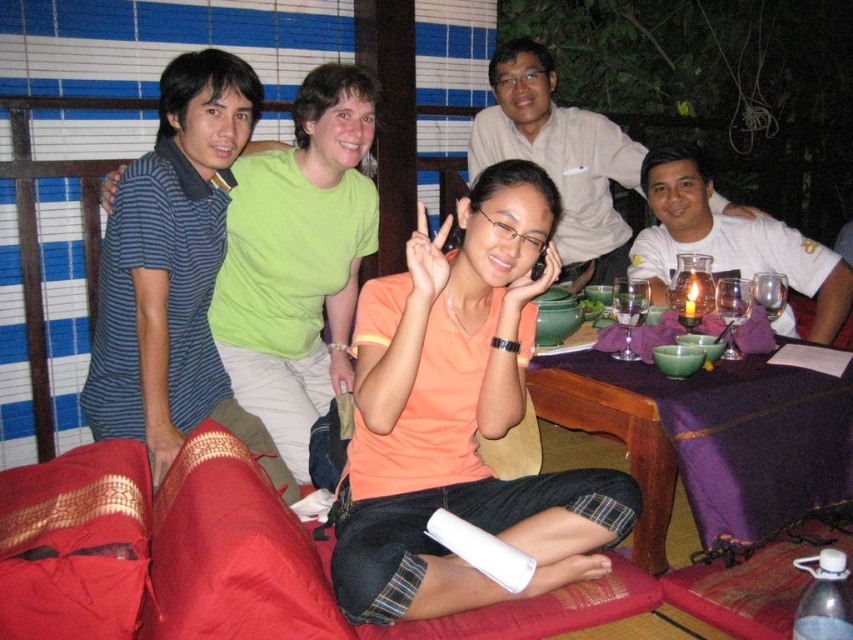
Between point (407, 401) and point (614, 401), which one is positioned behind?

Point (614, 401)

Is point (602, 531) less distant than point (654, 456)?

Yes.

Where is `orange matte shirt at center`? orange matte shirt at center is located at coordinates (460, 417).

I want to click on orange matte shirt at center, so click(460, 417).

Does point (607, 368) come in front of point (573, 188)?

Yes.

Which of these two, purple fabric dining table at center or white cotton shirt at upper center, stands shorter?

purple fabric dining table at center is shorter.

Who is more forward, (692, 387) or (576, 131)?

Positioned in front is point (692, 387).

What are the coordinates of `purple fabric dining table at center` in the screenshot? It's located at (706, 438).

Which is below, blue striped polo shirt at left or white matte shirt at upper right?

blue striped polo shirt at left is lower down.

Between blue striped polo shirt at left and white matte shirt at upper right, which one has more height?

With more height is blue striped polo shirt at left.

Who is more distant from viewer, (233, 180) or (665, 236)?

The point (665, 236) is more distant.

This screenshot has width=853, height=640. Find the location of `blue striped polo shirt at left`. blue striped polo shirt at left is located at coordinates (173, 272).